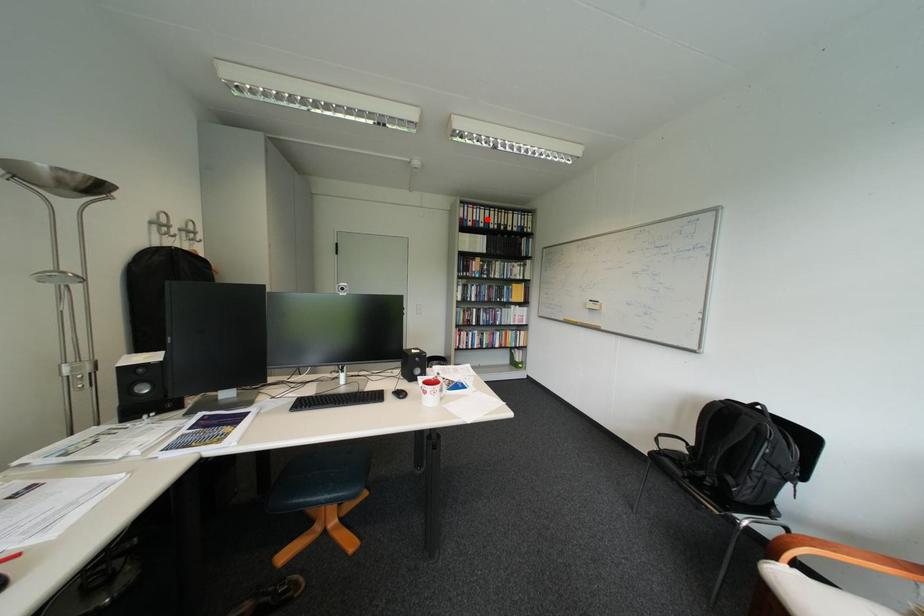
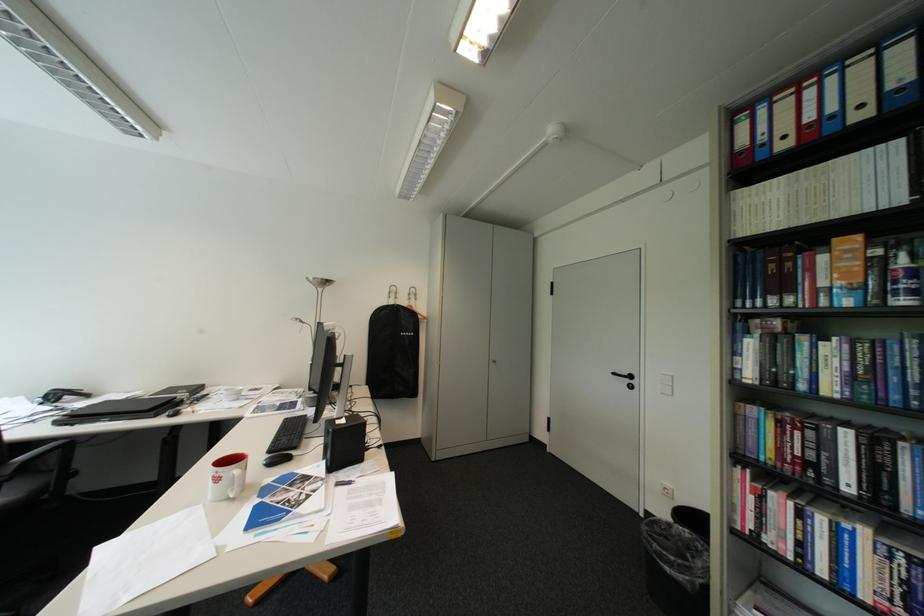
The point at the highlighted location is marked in the first image. Where is the corresponding point in the second image?

(821, 119)